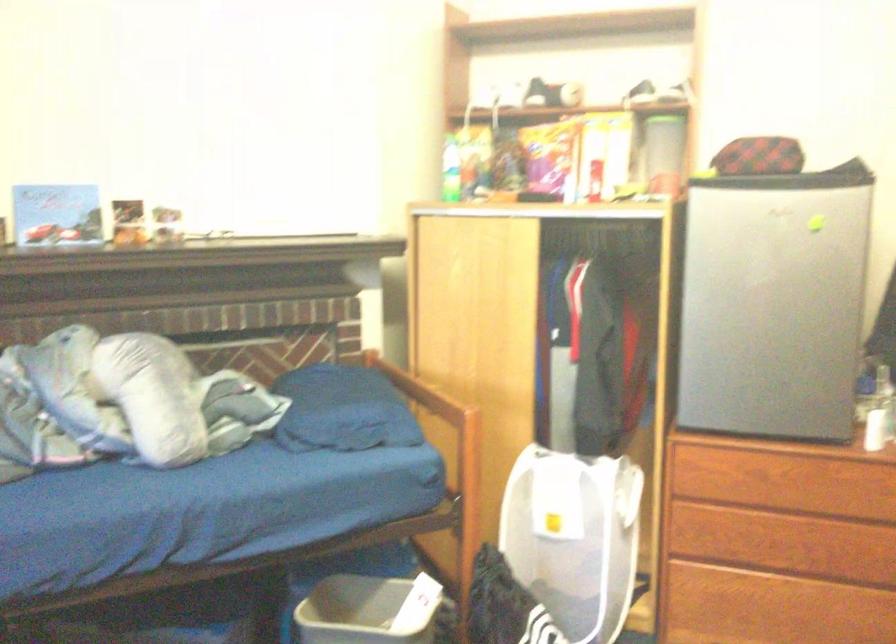
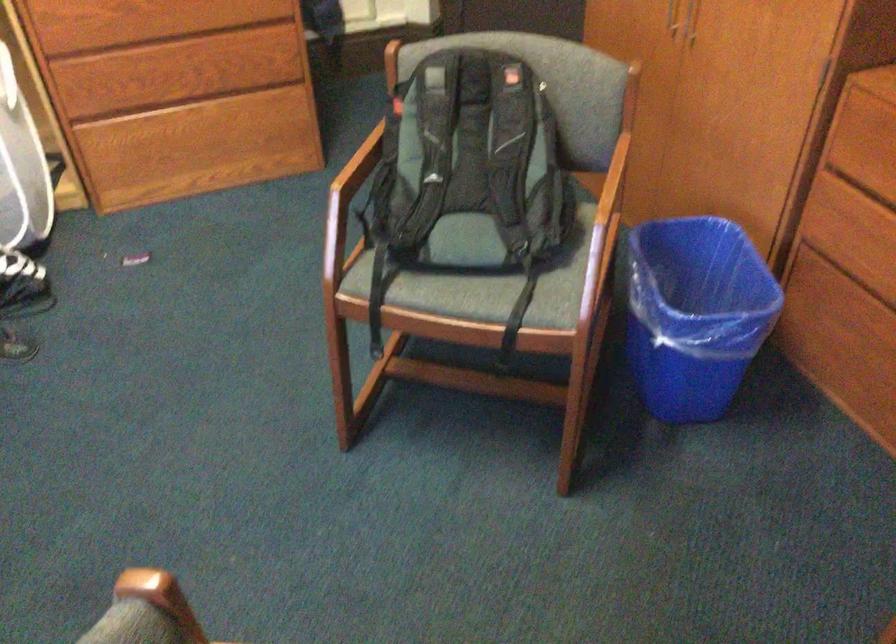
The images are taken continuously from a first-person perspective. In which direction is your viewpoint rotating?

The camera's rotation is toward right-down.